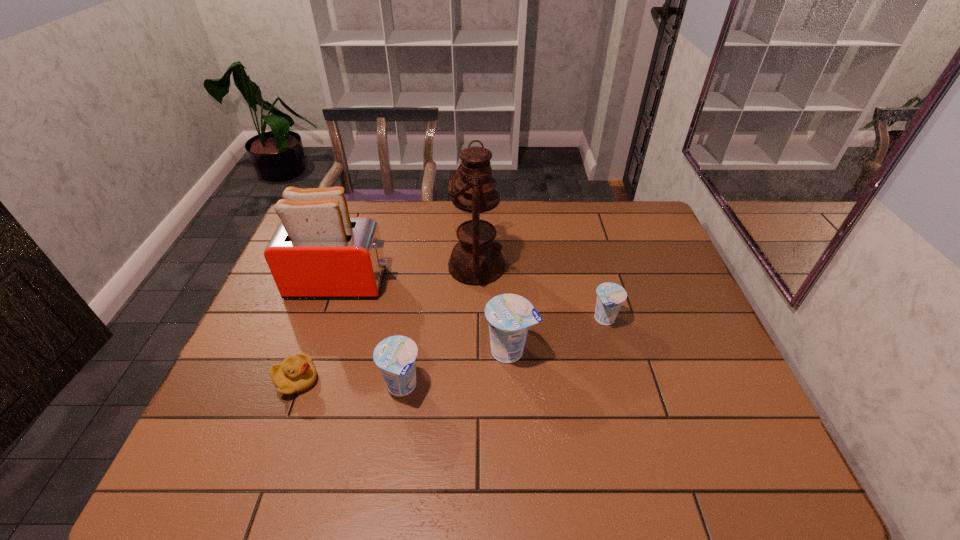
Where is `vacant space located 0.360m on the right of the tallest yogurt`? This screenshot has height=540, width=960. vacant space located 0.360m on the right of the tallest yogurt is located at coordinates (675, 350).

Locate an element on the screen. This screenshot has width=960, height=540. vacant region located 0.230m on the left of the fourth nearest object is located at coordinates (508, 319).

Locate an element on the screen. Image resolution: width=960 pixels, height=540 pixels. vacant space situated on the front-facing side of the fifth shortest object is located at coordinates (423, 283).

Identify the location of free spot located 0.350m on the right of the oil lamp. (616, 266).

This screenshot has width=960, height=540. In order to click on free space located on the front-facing side of the shortest object in this screenshot , I will do `click(359, 381)`.

Image resolution: width=960 pixels, height=540 pixels. I want to click on yogurt present at the near edge, so click(396, 356).

You are a GUI agent. You are given a task and a screenshot of the screen. Output one action in this format:
    pyautogui.click(x=<x>, y=<y>)
    Task: Click on the duckling situated at the near edge
    
    Given the screenshot: What is the action you would take?
    pyautogui.click(x=295, y=374)

Where is `toaster positioned at the left edge`? The width and height of the screenshot is (960, 540). toaster positioned at the left edge is located at coordinates (318, 251).

The height and width of the screenshot is (540, 960). I want to click on duckling present at the left edge, so click(x=295, y=374).

I want to click on object present at the near left corner, so click(x=295, y=374).